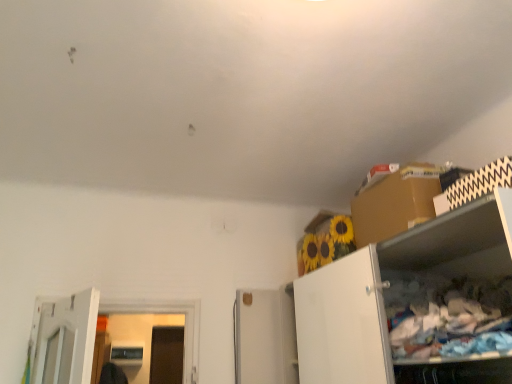
In order to click on white matte cabinet at right in this screenshot , I will do `click(411, 306)`.

What do you see at coordinates (411, 306) in the screenshot? I see `white matte cabinet at right` at bounding box center [411, 306].

What is the approximate width of brown cardboard box at upper right?

It is 18.29 inches.

In order to face brown cardboard box at upper right, should I rotate leftwards or rightwards?

To face it directly, rotate right by 20.205 degrees.

What do you see at coordinates (395, 203) in the screenshot?
I see `brown cardboard box at upper right` at bounding box center [395, 203].

Measure the distance between point (x=375, y=213) and camera.

Point (x=375, y=213) and camera are 7.56 feet apart from each other.

Identify the location of brown cardboard box at upper right. This screenshot has height=384, width=512. (395, 203).

You are a GUI agent. You are given a task and a screenshot of the screen. Output one action in this format:
    pyautogui.click(x=<x>, y=<y>)
    Task: Click on the white matte cabinet at right
    The width and height of the screenshot is (512, 384).
    Given the screenshot: What is the action you would take?
    [411, 306]

Is white matte cabinet at right at the left side of brown cardboard box at upper right?

Yes, white matte cabinet at right is to the left of brown cardboard box at upper right.

Does white matte cabinet at right come in front of brown cardboard box at upper right?

Yes, white matte cabinet at right is closer to the viewer.

Considering the points (342, 266) and (377, 202), which point is in front, point (342, 266) or point (377, 202)?

Positioned in front is point (342, 266).

From the image's perspective, is white matte cabinet at right above brown cardboard box at upper right?

No, from the image's perspective, white matte cabinet at right is not over brown cardboard box at upper right.

From a real-world perspective, is white matte cabinet at right positioned above or below brown cardboard box at upper right?

In terms of real-world spatial position, white matte cabinet at right is below brown cardboard box at upper right.

Looking at their sizes, would you say white matte cabinet at right is wider or thinner than brown cardboard box at upper right?

In the image, white matte cabinet at right appears to be wider than brown cardboard box at upper right.

Is white matte cabinet at right taller or shorter than brown cardboard box at upper right?

Considering their sizes, white matte cabinet at right has more height than brown cardboard box at upper right.

Considering the relative sizes of white matte cabinet at right and brown cardboard box at upper right in the image provided, is white matte cabinet at right smaller than brown cardboard box at upper right?

No, white matte cabinet at right is not smaller than brown cardboard box at upper right.

Could brown cardboard box at upper right be considered to be inside white matte cabinet at right?

No, brown cardboard box at upper right is not surrounded by white matte cabinet at right.

Would you say white matte cabinet at right is a long distance from brown cardboard box at upper right?

They are positioned close to each other.

Is white matte cabinet at right oriented towards brown cardboard box at upper right?

No, white matte cabinet at right does not turn towards brown cardboard box at upper right.

Can you tell me how much white matte cabinet at right and brown cardboard box at upper right differ in facing direction?

There is a 0.000163-degree angle between the facing directions of white matte cabinet at right and brown cardboard box at upper right.

The width and height of the screenshot is (512, 384). I want to click on cabinetry located in front of the brown cardboard box at upper right, so click(411, 306).

Does brown cardboard box at upper right appear on the right side of white matte cabinet at right?

Indeed, brown cardboard box at upper right is positioned on the right side of white matte cabinet at right.

Considering the relative positions of brown cardboard box at upper right and white matte cabinet at right in the image provided, is brown cardboard box at upper right behind white matte cabinet at right?

Yes.

Is point (386, 232) positioned after point (479, 256)?

Yes.

From the image's perspective, is brown cardboard box at upper right located beneath white matte cabinet at right?

Incorrect, from the image's perspective, brown cardboard box at upper right is higher than white matte cabinet at right.

From a real-world perspective, which object rests below the other?

In real-world perspective, white matte cabinet at right is lower.

Considering the relative sizes of brown cardboard box at upper right and white matte cabinet at right in the image provided, is brown cardboard box at upper right wider than white matte cabinet at right?

No, brown cardboard box at upper right is not wider than white matte cabinet at right.

Considering the sizes of objects brown cardboard box at upper right and white matte cabinet at right in the image provided, who is shorter, brown cardboard box at upper right or white matte cabinet at right?

Standing shorter between the two is brown cardboard box at upper right.

Considering the relative sizes of brown cardboard box at upper right and white matte cabinet at right in the image provided, is brown cardboard box at upper right smaller than white matte cabinet at right?

Yes, brown cardboard box at upper right is smaller than white matte cabinet at right.

Would you say white matte cabinet at right is part of brown cardboard box at upper right's contents?

Definitely not — white matte cabinet at right is not inside brown cardboard box at upper right.

Are brown cardboard box at upper right and white matte cabinet at right located far from each other?

That's not correct — brown cardboard box at upper right is a little close to white matte cabinet at right.

Is brown cardboard box at upper right looking in the opposite direction of white matte cabinet at right?

That's not correct — brown cardboard box at upper right is not looking away from white matte cabinet at right.

What's the angular difference between brown cardboard box at upper right and white matte cabinet at right's facing directions?

They differ by 0.000163 degrees in their facing directions.

Find the location of `cabinetry in front of the brown cardboard box at upper right`. cabinetry in front of the brown cardboard box at upper right is located at coordinates (411, 306).

Find the location of a particular element. The image size is (512, 384). cabinetry below the brown cardboard box at upper right (from the image's perspective) is located at coordinates (411, 306).

The width and height of the screenshot is (512, 384). What are the coordinates of `cardboard box to the right of white matte cabinet at right` in the screenshot? It's located at (395, 203).